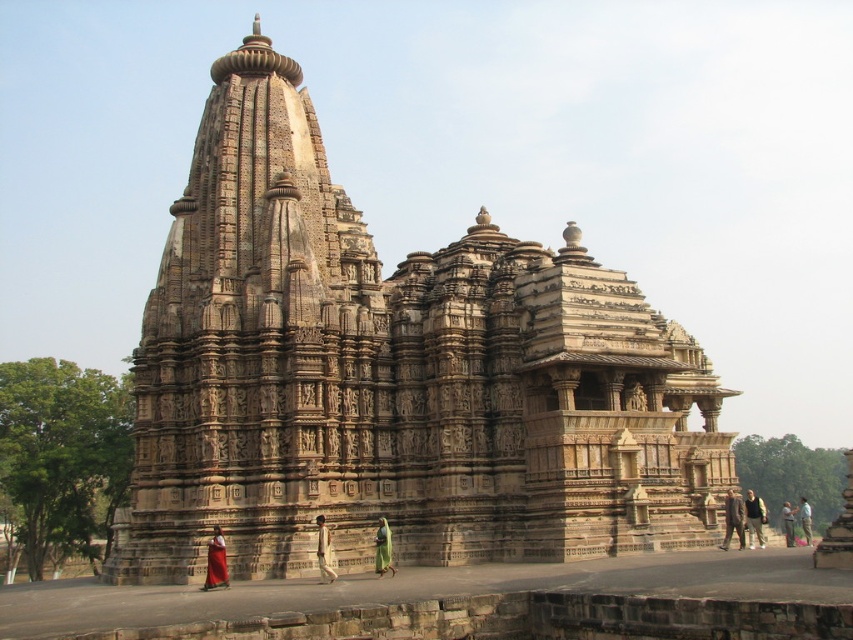
Which is more to the right, beige stone hindu temple at center or green fabric dress at center?

green fabric dress at center

Does beige stone hindu temple at center appear on the left side of green fabric dress at center?

Yes, beige stone hindu temple at center is to the left of green fabric dress at center.

The height and width of the screenshot is (640, 853). What are the coordinates of `beige stone hindu temple at center` in the screenshot? It's located at (392, 378).

Locate an element on the screen. beige stone hindu temple at center is located at coordinates (392, 378).

Is green fabric dress at lower right taller than light brown fabric at lower right?

Incorrect, green fabric dress at lower right's height is not larger of light brown fabric at lower right's.

Is point (781, 522) positioned before point (798, 509)?

Yes, it is.

Which is in front, point (782, 509) or point (799, 509)?

Point (799, 509) is in front.

The height and width of the screenshot is (640, 853). What are the coordinates of `green fabric dress at lower right` in the screenshot? It's located at (787, 522).

Does dark brown leather jacket at lower right have a larger size compared to green fabric dress at center?

Indeed, dark brown leather jacket at lower right has a larger size compared to green fabric dress at center.

This screenshot has width=853, height=640. What are the coordinates of `dark brown leather jacket at lower right` in the screenshot? It's located at (753, 518).